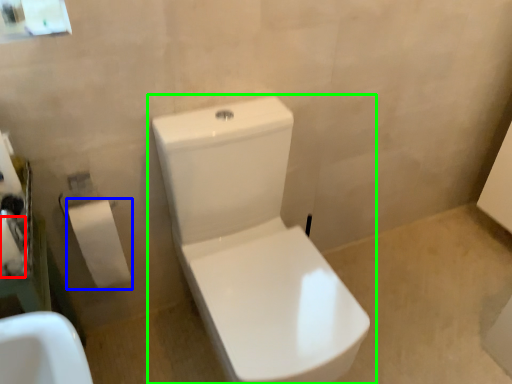
Question: Estimate the real-world distances between objects in this image. Which object is farther from toilet paper (highlighted by a red box), toiletry (highlighted by a blue box) or toilet (highlighted by a green box)?

Choices:
 (A) toiletry
 (B) toilet

Answer: (B)